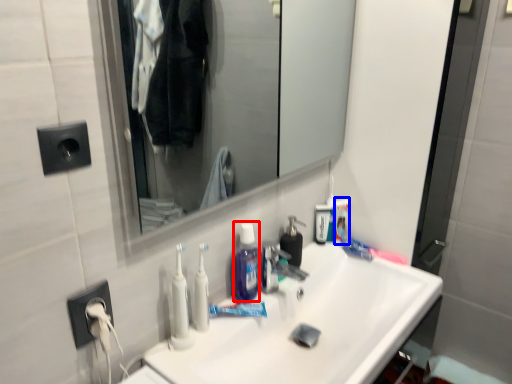
Question: Among these objects, which one is farthest to the camera, mouthwash (highlighted by a red box) or toiletry (highlighted by a blue box)?

Choices:
 (A) mouthwash
 (B) toiletry

Answer: (B)